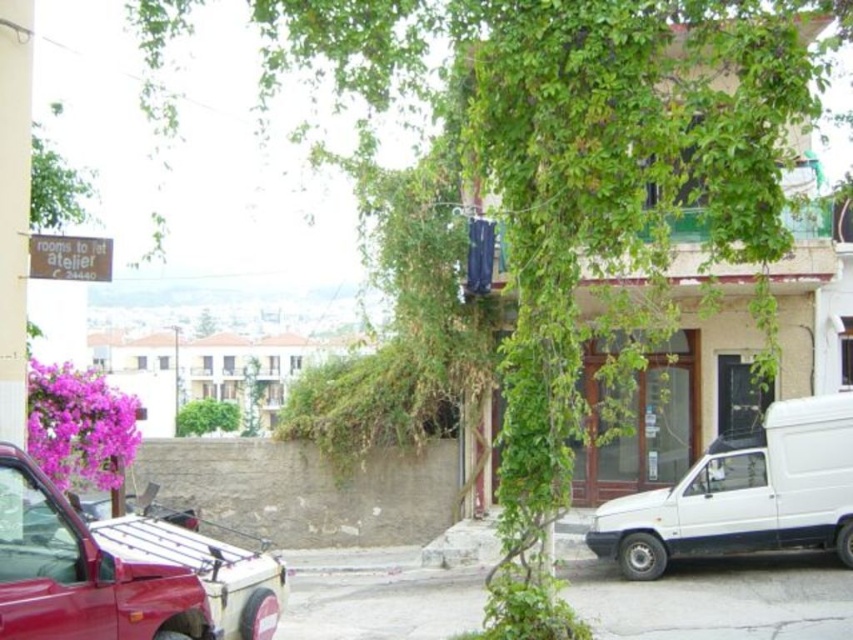
Question: Among these points, which one is nearest to the camera?

Choices:
 (A) (833, 422)
 (B) (157, 627)

Answer: (B)

Question: Which object appears closest to the camera in this image?

Choices:
 (A) metallic red car at lower left
 (B) white matte van at lower right

Answer: (A)

Question: Is metallic red car at lower left thinner than white matte van at lower right?

Choices:
 (A) yes
 (B) no

Answer: (A)

Question: Among these points, which one is farthest from the camera?

Choices:
 (A) (86, 580)
 (B) (761, 497)

Answer: (B)

Question: Can you confirm if metallic red car at lower left is bigger than white matte van at lower right?

Choices:
 (A) yes
 (B) no

Answer: (B)

Question: Can you confirm if metallic red car at lower left is bigger than white matte van at lower right?

Choices:
 (A) no
 (B) yes

Answer: (A)